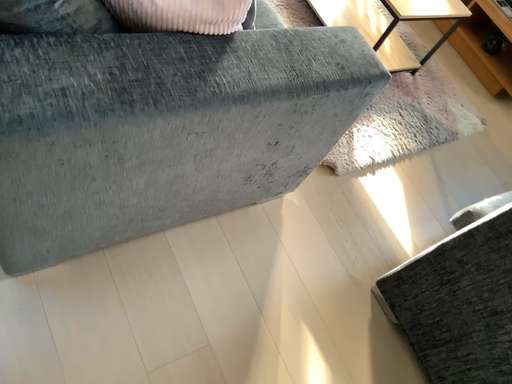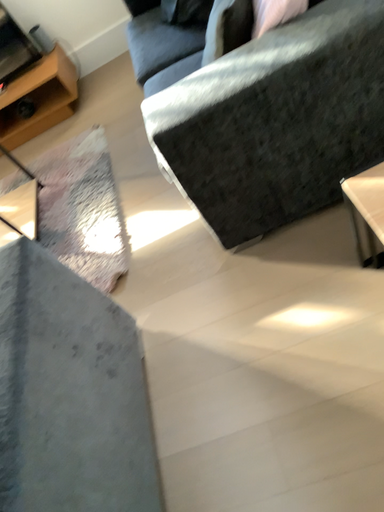
Question: How did the camera likely rotate when shooting the video?

Choices:
 (A) rotated downward
 (B) rotated upward

Answer: (B)